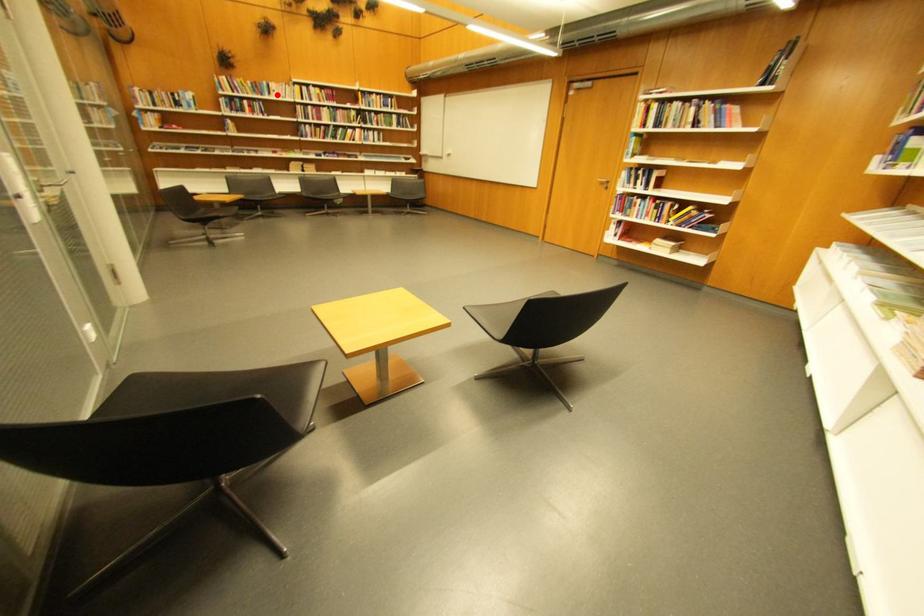
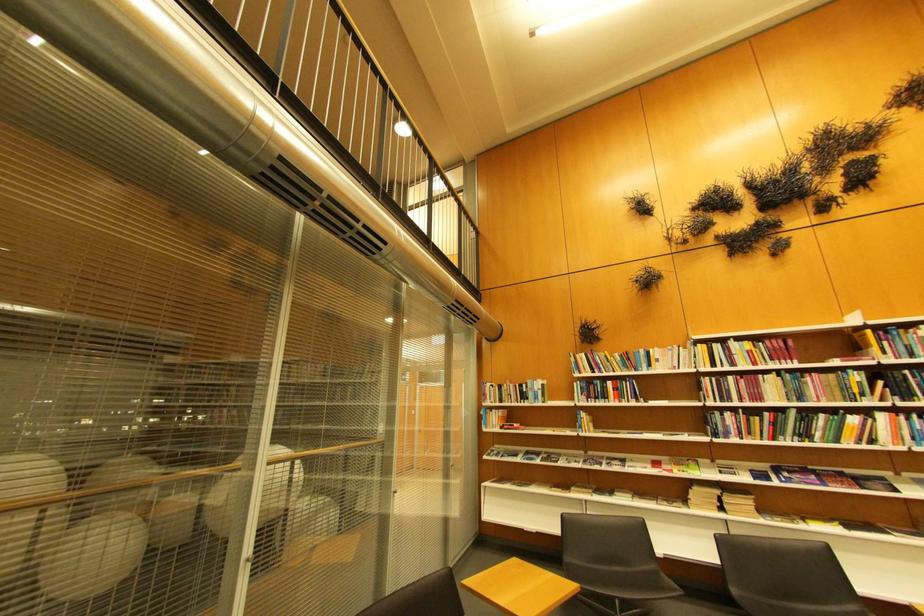
Locate, in the second image, the point that corresponds to the highlighted location in the first image.

(654, 368)